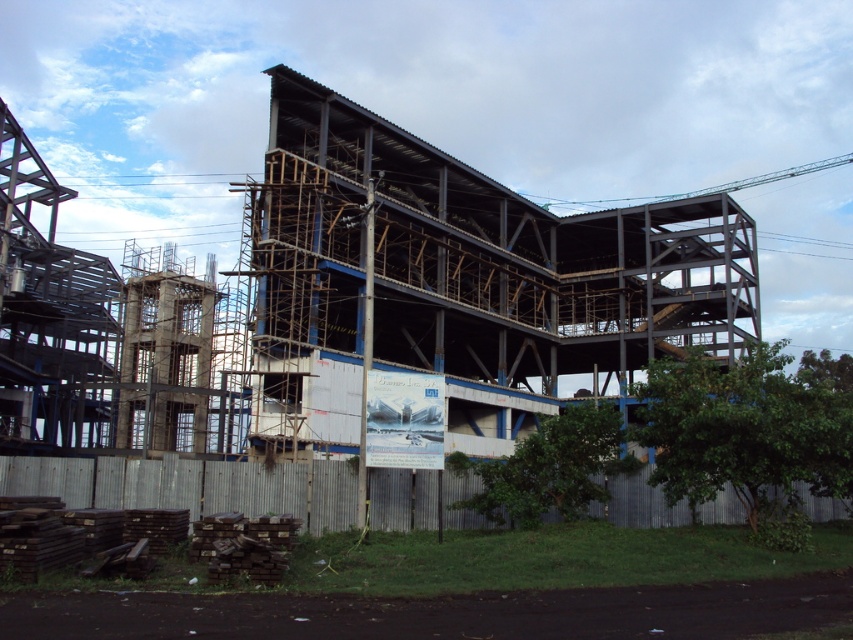
Question: Which of the following is the farthest from the observer?

Choices:
 (A) gray corrugated metal fence at lower center
 (B) metal scaffolding at center

Answer: (B)

Question: Can you confirm if metal scaffolding at center is bigger than gray corrugated metal fence at lower center?

Choices:
 (A) no
 (B) yes

Answer: (B)

Question: Does metal scaffolding at center appear under gray corrugated metal fence at lower center?

Choices:
 (A) no
 (B) yes

Answer: (A)

Question: Which point is farther to the camera?

Choices:
 (A) metal scaffolding at center
 (B) gray corrugated metal fence at lower center

Answer: (A)

Question: Is metal scaffolding at center smaller than gray corrugated metal fence at lower center?

Choices:
 (A) no
 (B) yes

Answer: (A)